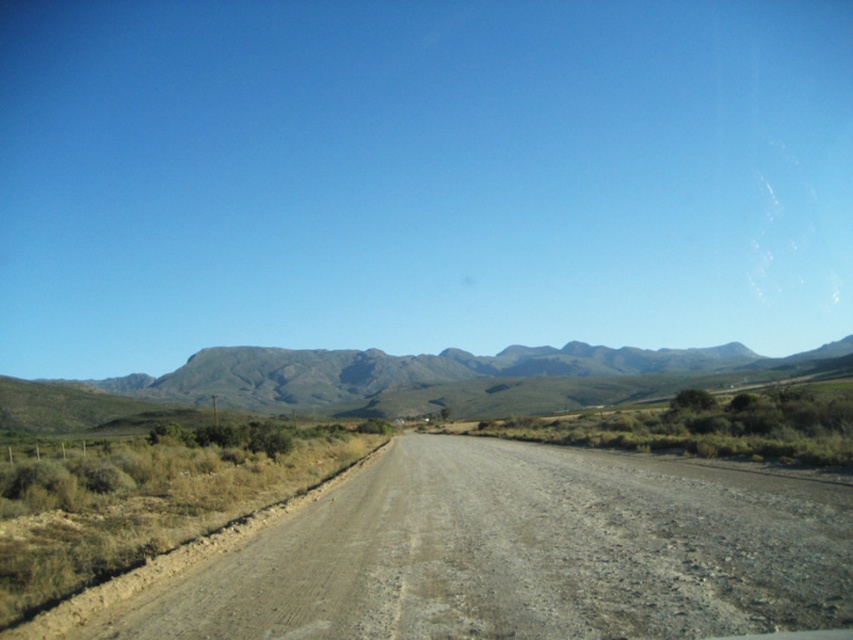
Question: Does dusty gravel road at center have a greater width compared to gray rocky mountain at center?

Choices:
 (A) no
 (B) yes

Answer: (A)

Question: Which object appears closest to the camera in this image?

Choices:
 (A) gray rocky mountain at center
 (B) dusty gravel road at center

Answer: (B)

Question: Is dusty gravel road at center positioned before gray rocky mountain at center?

Choices:
 (A) yes
 (B) no

Answer: (A)

Question: Can you confirm if dusty gravel road at center is bigger than gray rocky mountain at center?

Choices:
 (A) yes
 (B) no

Answer: (B)

Question: Which point is closer to the camera taking this photo?

Choices:
 (A) (656, 380)
 (B) (486, 458)

Answer: (B)